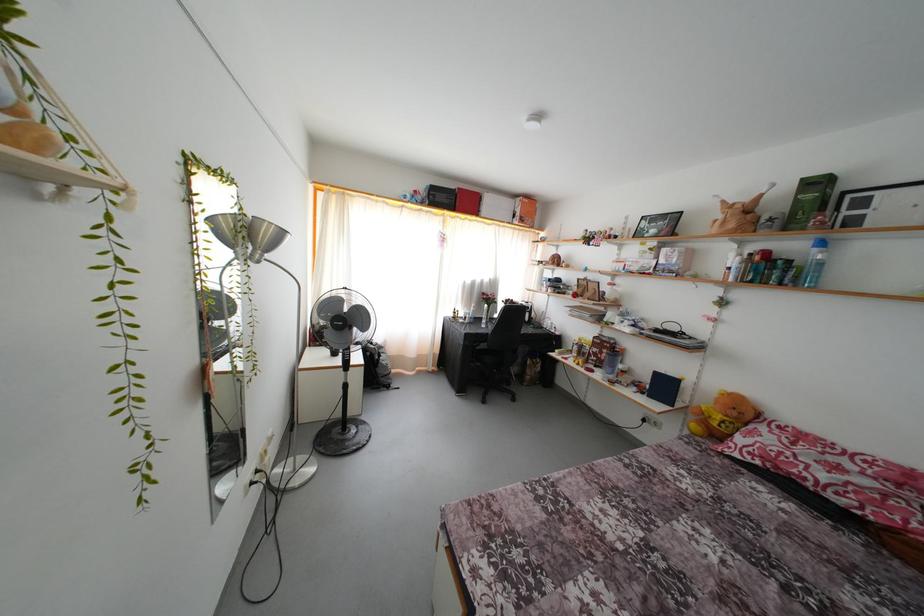
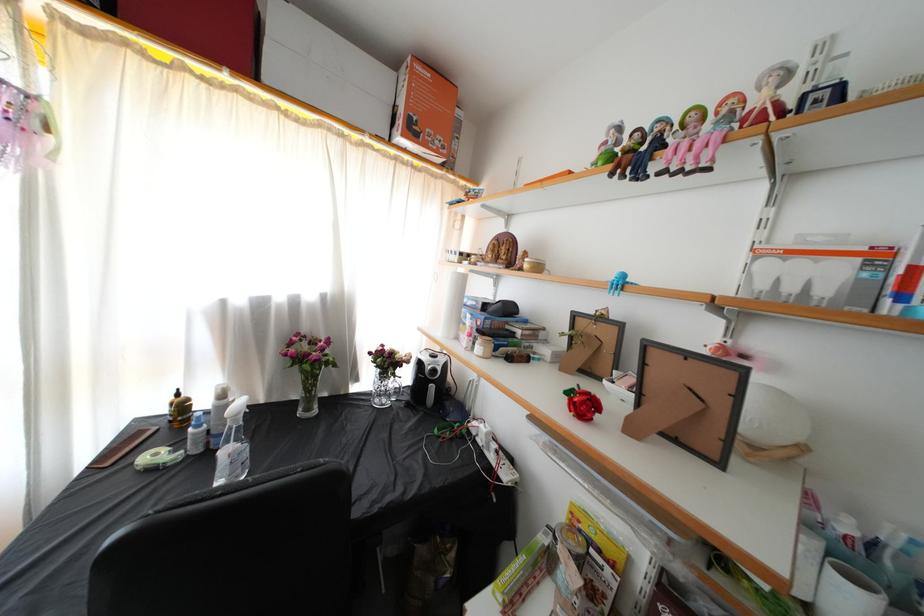
In the second image, find the point that corresponds to (456,321) in the first image.

(171, 416)